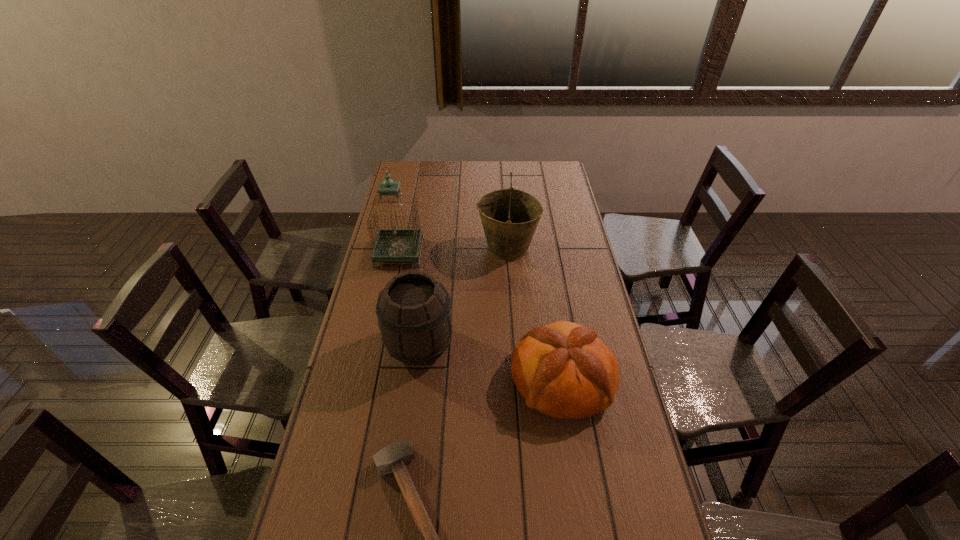
Find the location of `unoccupied area between the farther wine bucket and the nearer wine bucket`. unoccupied area between the farther wine bucket and the nearer wine bucket is located at coordinates (464, 297).

This screenshot has width=960, height=540. In order to click on free area in between the birdcage and the taller wine bucket in this screenshot , I will do [x=453, y=250].

Locate an element on the screen. free space between the birdcage and the farther wine bucket is located at coordinates (453, 250).

The width and height of the screenshot is (960, 540). Find the location of `vacant space that is in between the birdcage and the right wine bucket`. vacant space that is in between the birdcage and the right wine bucket is located at coordinates (453, 250).

At what (x,y) coordinates should I click in order to perform the action: click on vacant area that lies between the taller wine bucket and the shorter wine bucket. Please return your answer as a coordinate pair (x, y). Looking at the image, I should click on (464, 297).

Where is `object that stands as the third closest to the bread`? object that stands as the third closest to the bread is located at coordinates (510, 217).

Locate which object is the third closest to the shortest object. Please provide its 2D coordinates. Your answer should be formatted as a tuple, i.e. [(x, y)], where the tuple contains the x and y coordinates of a point satisfying the conditions above.

[(391, 245)]

Where is `free space in the image that satisfies the following two spatial constraints: 1. on the front side of the taller wine bucket; 2. at the door of the birdcage`? The width and height of the screenshot is (960, 540). free space in the image that satisfies the following two spatial constraints: 1. on the front side of the taller wine bucket; 2. at the door of the birdcage is located at coordinates (508, 253).

I want to click on free space in the image that satisfies the following two spatial constraints: 1. at the door of the birdcage; 2. on the left side of the second shortest object, so click(x=372, y=379).

Locate an element on the screen. vacant region that satisfies the following two spatial constraints: 1. on the back side of the third tallest object; 2. at the door of the birdcage is located at coordinates (431, 253).